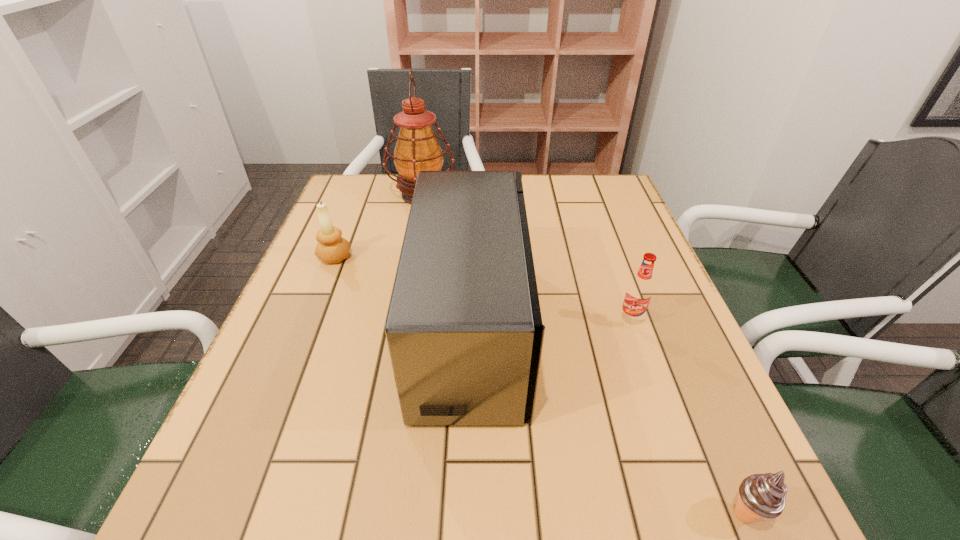
You are a GUI agent. You are given a task and a screenshot of the screen. Output one action in this format:
    pyautogui.click(x=<x>, y=<y>)
    Task: Click on the free space between the second object from right to left and the fourth shortest object
    The image size is (960, 540).
    Given the screenshot: What is the action you would take?
    pyautogui.click(x=551, y=325)

Where is `free spot between the candle_holder and the shortest object`? This screenshot has width=960, height=540. free spot between the candle_holder and the shortest object is located at coordinates (540, 386).

Identify the location of empty location between the root beer and the microwave_oven. This screenshot has width=960, height=540. (551, 325).

The width and height of the screenshot is (960, 540). Find the location of `object that can be found as the third closest to the second object from right to left`. object that can be found as the third closest to the second object from right to left is located at coordinates [x=417, y=149].

Image resolution: width=960 pixels, height=540 pixels. I want to click on object that is the third closest to the microwave_oven, so click(x=417, y=149).

The image size is (960, 540). Find the location of `free space that satisfies the following two spatial constraints: 1. on the front side of the shortest object; 2. on the left side of the farthest object`. free space that satisfies the following two spatial constraints: 1. on the front side of the shortest object; 2. on the left side of the farthest object is located at coordinates (361, 514).

The width and height of the screenshot is (960, 540). In order to click on vacant region that satisfies the following two spatial constraints: 1. on the back side of the shortest object; 2. on the front-facing side of the second tallest object in this screenshot , I will do `click(666, 329)`.

Image resolution: width=960 pixels, height=540 pixels. I want to click on free space that satisfies the following two spatial constraints: 1. on the front side of the fourth object from left to right; 2. on the left side of the candle_holder, so click(310, 320).

The image size is (960, 540). I want to click on vacant space that satisfies the following two spatial constraints: 1. on the front-facing side of the second tallest object; 2. on the back side of the nearest object, so click(x=468, y=514).